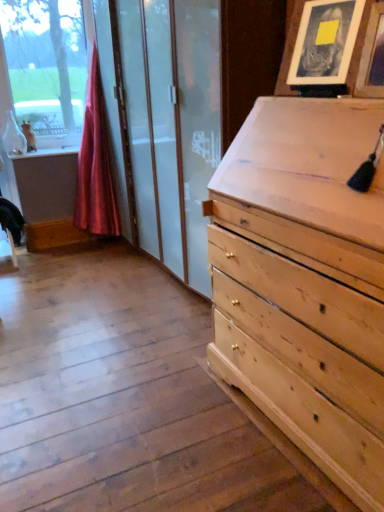
Question: Can you confirm if silky red curtain at left is bigger than matte wooden picture frame at upper right, which appears as the first picture frame when viewed from the back?

Choices:
 (A) no
 (B) yes

Answer: (B)

Question: From a real-world perspective, is silky red curtain at left on matte wooden picture frame at upper right, which appears as the first picture frame when viewed from the back?

Choices:
 (A) no
 (B) yes

Answer: (A)

Question: Considering the relative positions of silky red curtain at left and matte wooden picture frame at upper right, which appears as the 2th picture frame when viewed from the front, in the image provided, is silky red curtain at left to the left of matte wooden picture frame at upper right, which appears as the 2th picture frame when viewed from the front, from the viewer's perspective?

Choices:
 (A) yes
 (B) no

Answer: (A)

Question: Considering the relative positions of silky red curtain at left and matte wooden picture frame at upper right, which appears as the first picture frame when viewed from the back, in the image provided, is silky red curtain at left to the right of matte wooden picture frame at upper right, which appears as the first picture frame when viewed from the back, from the viewer's perspective?

Choices:
 (A) yes
 (B) no

Answer: (B)

Question: Is silky red curtain at left thinner than matte wooden picture frame at upper right, which appears as the 2th picture frame when viewed from the front?

Choices:
 (A) no
 (B) yes

Answer: (A)

Question: Considering their positions, is wooden picture frame at upper right, which is the first picture frame from front to back, located in front of or behind matte wooden picture frame at upper right, which appears as the first picture frame when viewed from the back?

Choices:
 (A) front
 (B) behind

Answer: (A)

Question: From the image's perspective, is wooden picture frame at upper right, the second picture frame positioned from the back, located above or below matte wooden picture frame at upper right, which appears as the first picture frame when viewed from the back?

Choices:
 (A) below
 (B) above

Answer: (A)

Question: Would you say wooden picture frame at upper right, the second picture frame positioned from the back, is to the left or to the right of matte wooden picture frame at upper right, which appears as the 2th picture frame when viewed from the front, in the picture?

Choices:
 (A) left
 (B) right

Answer: (B)

Question: Is wooden picture frame at upper right, the second picture frame positioned from the back, inside or outside of matte wooden picture frame at upper right, which appears as the first picture frame when viewed from the back?

Choices:
 (A) inside
 (B) outside

Answer: (B)

Question: From the image's perspective, relative to wooden picture frame at upper right, which is the first picture frame from front to back, is matte wooden picture frame at upper right, which appears as the first picture frame when viewed from the back, above or below?

Choices:
 (A) below
 (B) above

Answer: (B)

Question: Considering the positions of point (314, 61) and point (372, 82), is point (314, 61) closer or farther from the camera than point (372, 82)?

Choices:
 (A) closer
 (B) farther

Answer: (B)

Question: Is matte wooden picture frame at upper right, which appears as the first picture frame when viewed from the back, bigger or smaller than wooden picture frame at upper right, the second picture frame positioned from the back?

Choices:
 (A) small
 (B) big

Answer: (B)

Question: Is matte wooden picture frame at upper right, which appears as the 2th picture frame when viewed from the front, inside the boundaries of wooden picture frame at upper right, the second picture frame positioned from the back, or outside?

Choices:
 (A) inside
 (B) outside

Answer: (B)

Question: Is silky red curtain at left to the left or to the right of wooden picture frame at upper right, which is the first picture frame from front to back, in the image?

Choices:
 (A) right
 (B) left

Answer: (B)

Question: In terms of height, does silky red curtain at left look taller or shorter compared to wooden picture frame at upper right, the second picture frame positioned from the back?

Choices:
 (A) tall
 (B) short

Answer: (A)